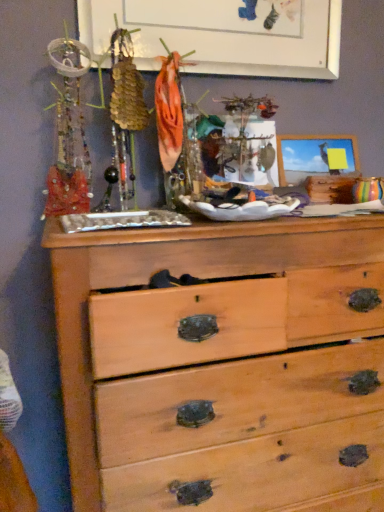
Question: Does white matte bulletin board at upper center have a greater height compared to natural wood chest of drawers at center?

Choices:
 (A) no
 (B) yes

Answer: (A)

Question: Is white matte bulletin board at upper center oriented away from natural wood chest of drawers at center?

Choices:
 (A) yes
 (B) no

Answer: (B)

Question: From the image's perspective, is white matte bulletin board at upper center located beneath natural wood chest of drawers at center?

Choices:
 (A) yes
 (B) no

Answer: (B)

Question: Considering the relative sizes of white matte bulletin board at upper center and natural wood chest of drawers at center in the image provided, is white matte bulletin board at upper center smaller than natural wood chest of drawers at center?

Choices:
 (A) no
 (B) yes

Answer: (B)

Question: Considering the relative positions of white matte bulletin board at upper center and natural wood chest of drawers at center in the image provided, is white matte bulletin board at upper center to the right of natural wood chest of drawers at center from the viewer's perspective?

Choices:
 (A) yes
 (B) no

Answer: (B)

Question: Considering the relative sizes of white matte bulletin board at upper center and natural wood chest of drawers at center in the image provided, is white matte bulletin board at upper center wider than natural wood chest of drawers at center?

Choices:
 (A) yes
 (B) no

Answer: (B)

Question: From a real-world perspective, is natural wood chest of drawers at center physically below white matte bulletin board at upper center?

Choices:
 (A) yes
 (B) no

Answer: (A)

Question: Considering the relative sizes of natural wood chest of drawers at center and white matte bulletin board at upper center in the image provided, is natural wood chest of drawers at center bigger than white matte bulletin board at upper center?

Choices:
 (A) no
 (B) yes

Answer: (B)

Question: Would you say white matte bulletin board at upper center is part of natural wood chest of drawers at center's contents?

Choices:
 (A) yes
 (B) no

Answer: (B)

Question: Is natural wood chest of drawers at center smaller than white matte bulletin board at upper center?

Choices:
 (A) yes
 (B) no

Answer: (B)

Question: Is the depth of natural wood chest of drawers at center less than that of white matte bulletin board at upper center?

Choices:
 (A) no
 (B) yes

Answer: (B)

Question: Does natural wood chest of drawers at center come behind white matte bulletin board at upper center?

Choices:
 (A) yes
 (B) no

Answer: (B)

Question: Is natural wood chest of drawers at center situated inside white matte bulletin board at upper center or outside?

Choices:
 (A) inside
 (B) outside

Answer: (B)